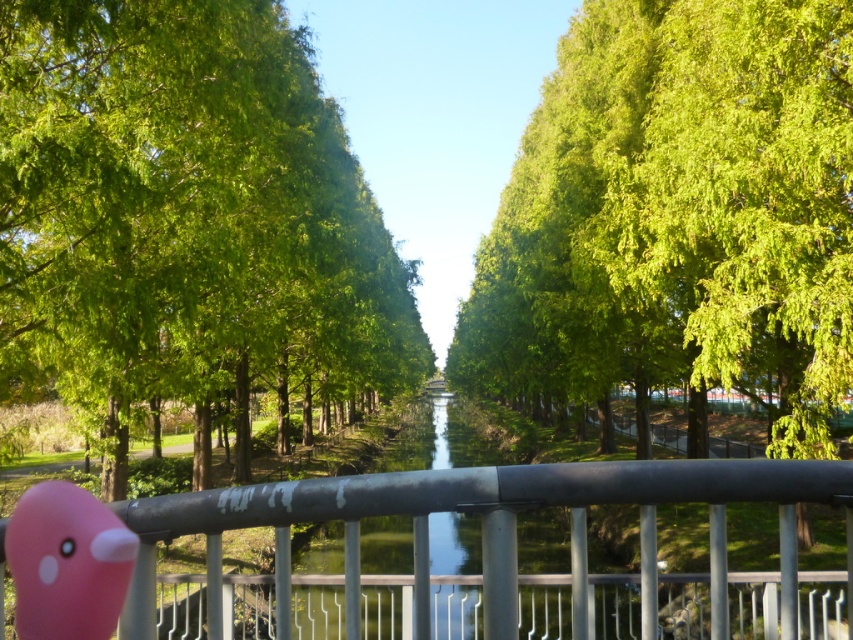
You are standing at the origin point of the coordinate system. You want to walk towards the green leafy trees at center. In which direction should you move?

The green leafy trees at center are located at coordinate point 0.344 on the x axis and 0.218 on the y axis, so you should move in the positive x and positive y direction to reach them.

You are a painter who wants to capture the canal scene. You notice the green leafy trees at center and the metallic gray railing at center. Which object appears narrower in the painting?

The green leafy trees at center appears narrower than the metallic gray railing at center in the painting.